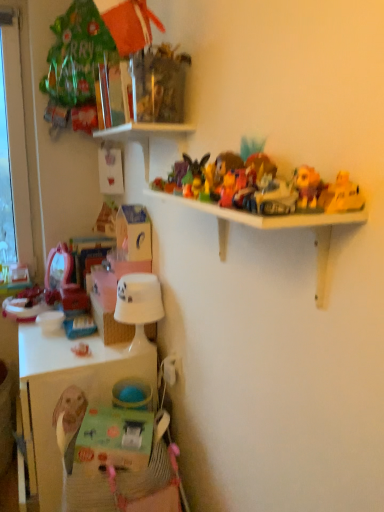
Question: Does point [102, 309] appear closer or farther from the camera than point [248, 225]?

Choices:
 (A) closer
 (B) farther

Answer: (B)

Question: Considering the relative positions of woven straw basket at lower center and white plastic shelf at upper center in the image provided, is woven straw basket at lower center to the left or to the right of white plastic shelf at upper center?

Choices:
 (A) right
 (B) left

Answer: (B)

Question: Which object is positioned closest to the matte pink toy at lower left, positioned as the 1th toy in bottom-to-top order?

Choices:
 (A) woven straw basket at lower center
 (B) white cardboard cabinet at lower left
 (C) white glossy lampshade at lower center
 (D) matte cardboard box at lower left
 (E) plush yellow bear at upper right, marked as the 1th toy in a top-to-bottom arrangement

Answer: (A)

Question: Which object is the closest to the matte pink toy at lower left, which is the 2th toy from right to left?

Choices:
 (A) white plastic shelf at upper center
 (B) white cardboard cabinet at lower left
 (C) matte cardboard box at lower left
 (D) woven straw basket at lower center
 (E) plush yellow bear at upper right, the 2th toy positioned from the bottom

Answer: (D)